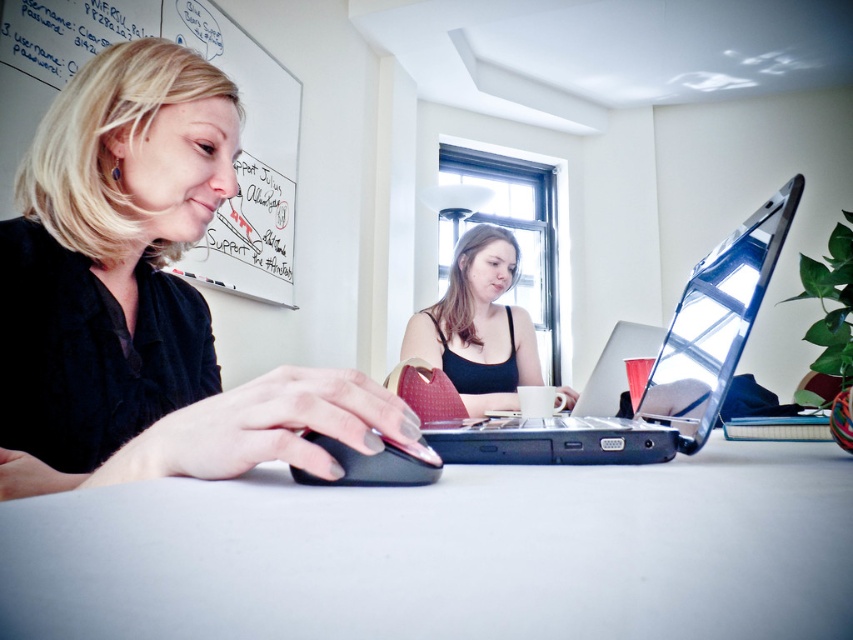
Which is below, matte black mouse at center or black plastic laptop at center?

black plastic laptop at center

Does matte black mouse at center appear over black plastic laptop at center?

Indeed, matte black mouse at center is positioned over black plastic laptop at center.

Measure the distance between point (231,449) and camera.

Point (231,449) and camera are 15.07 inches apart.

Identify the location of matte black mouse at center. (142, 298).

Does gray matte table at center appear under black matte tank top at center?

Correct, gray matte table at center is located below black matte tank top at center.

How distant is gray matte table at center from black matte tank top at center?

4.00 feet

Locate an element on the screen. gray matte table at center is located at coordinates (x=448, y=554).

Identify the location of gray matte table at center. (448, 554).

Does matte black mouse at center appear on the right side of black matte mouse at center?

In fact, matte black mouse at center is to the left of black matte mouse at center.

The image size is (853, 640). What do you see at coordinates (142, 298) in the screenshot?
I see `matte black mouse at center` at bounding box center [142, 298].

Identify the location of matte black mouse at center. 142,298.